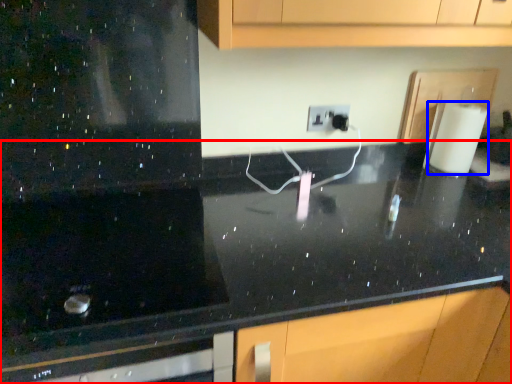
Question: Which object is closer to the camera taking this photo, countertop (highlighted by a red box) or paper towel (highlighted by a blue box)?

Choices:
 (A) countertop
 (B) paper towel

Answer: (A)